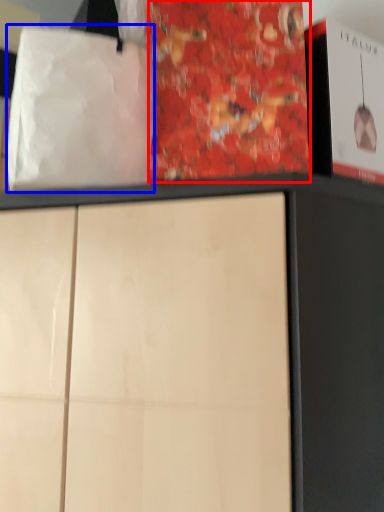
Question: Which point is further to the camera, paperback book (highlighted by a red box) or tote bag (highlighted by a blue box)?

Choices:
 (A) paperback book
 (B) tote bag

Answer: (A)